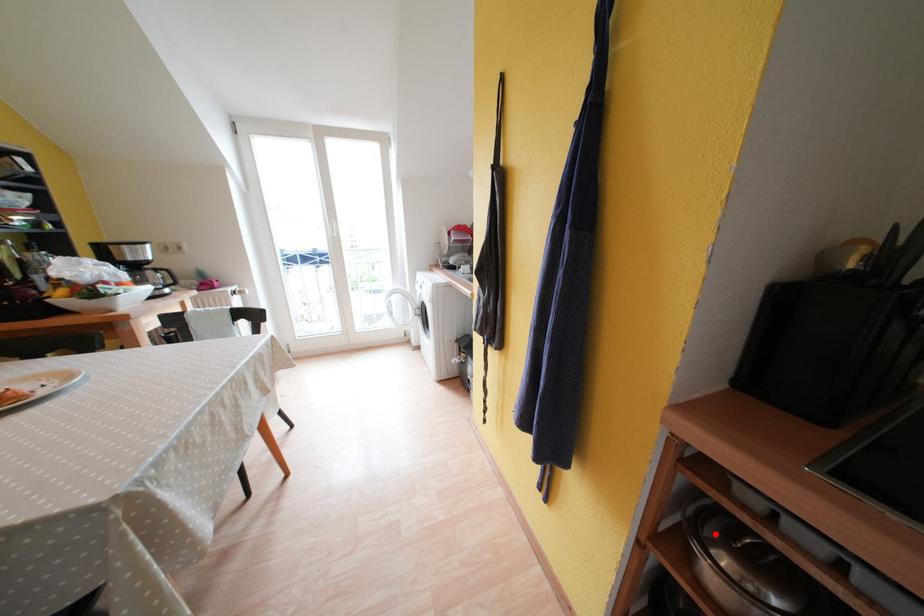
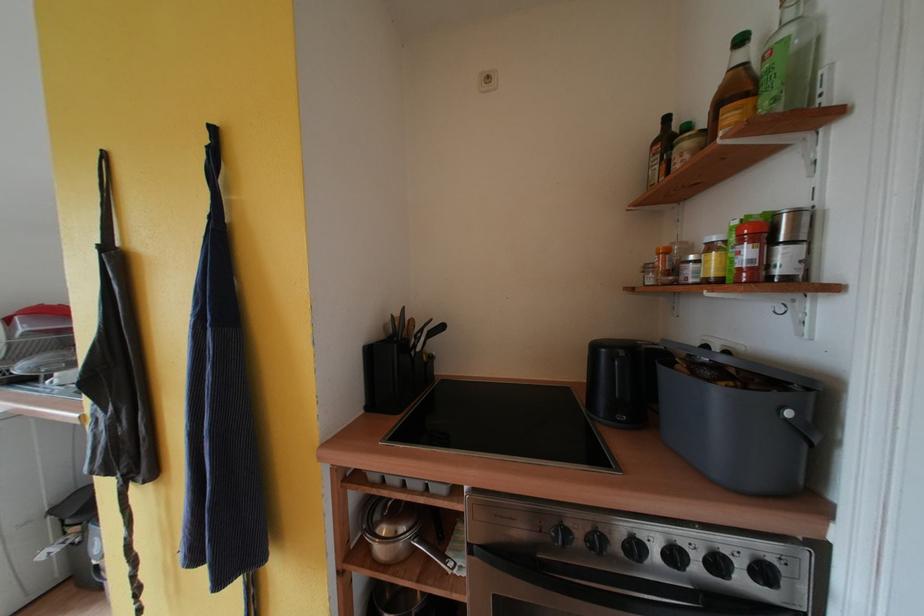
The point at the highlighted location is marked in the first image. Where is the corresponding point in the second image?

(383, 521)